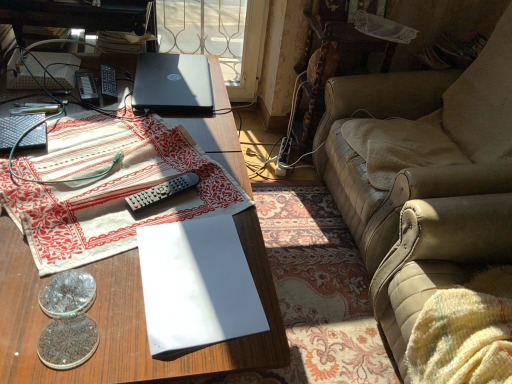
This screenshot has height=384, width=512. Find the location of `vacant area that lies to the right of shiny metallic coin at lower left, placed as the 1th coin when sorted from back to front`. vacant area that lies to the right of shiny metallic coin at lower left, placed as the 1th coin when sorted from back to front is located at coordinates (126, 312).